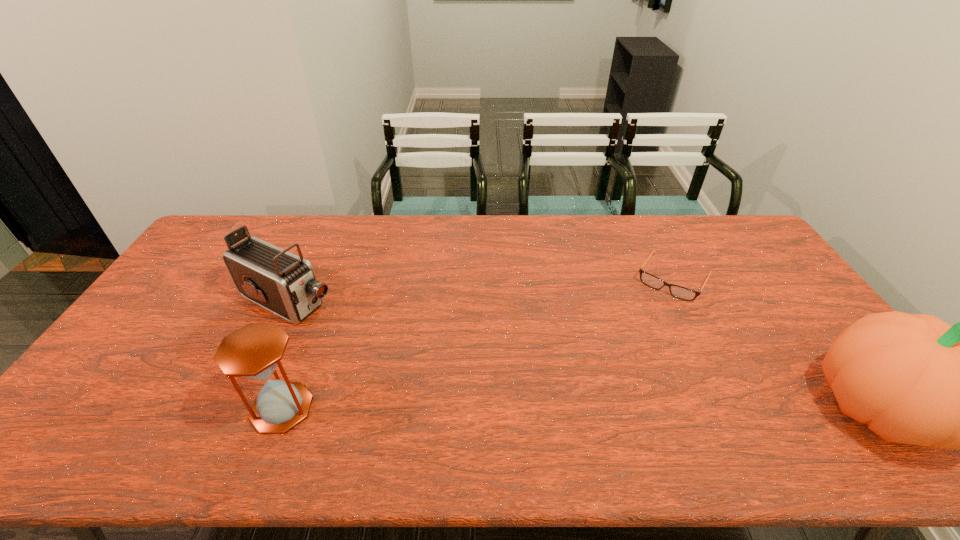
I want to click on free space on the desktop that is between the hourglass and the pumpkin and is positioned on the front-facing side of the shortest object, so click(x=596, y=409).

This screenshot has width=960, height=540. I want to click on free space on the desktop that is between the hourglass and the tallest object and is positioned at the lens of the camcorder, so click(x=500, y=409).